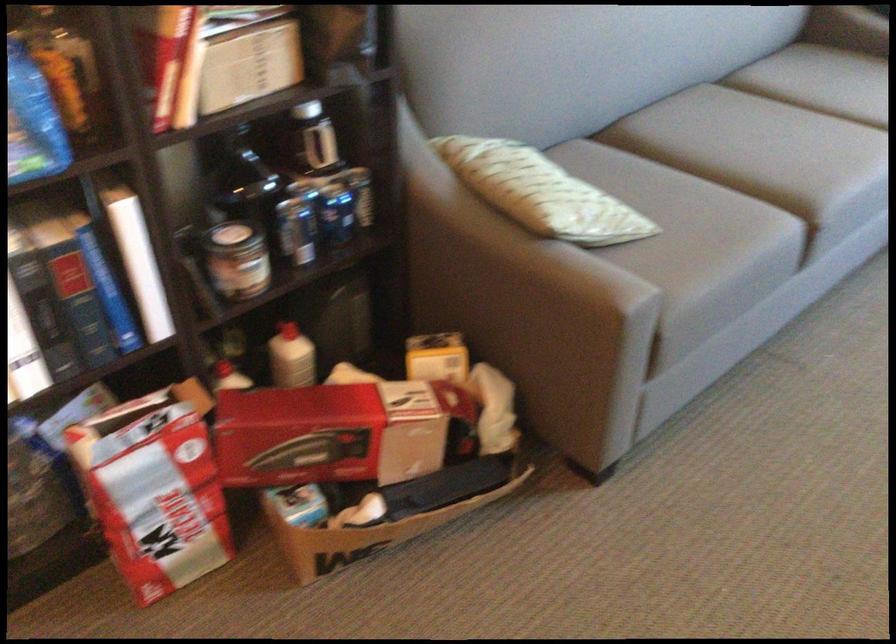
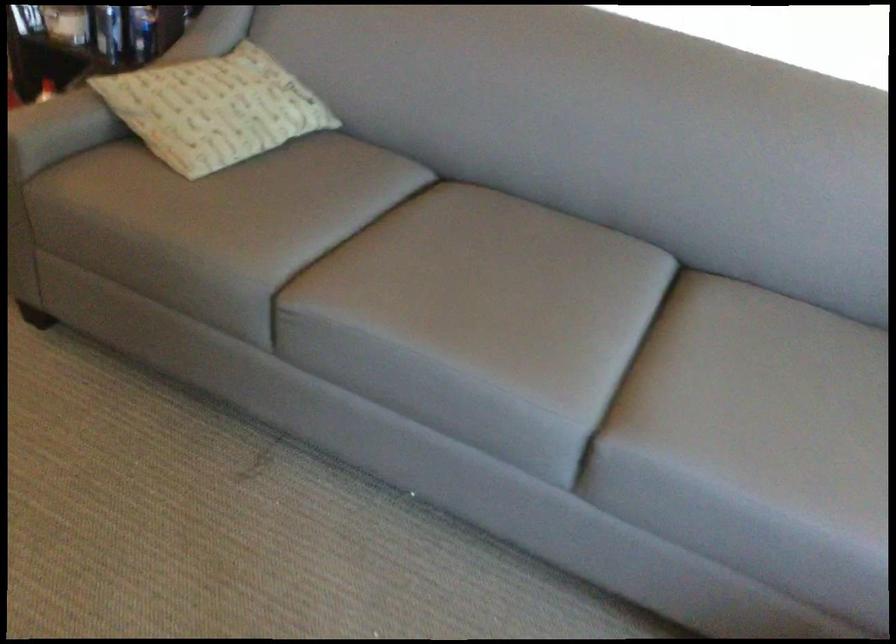
The point at (533,176) is marked in the first image. Where is the corresponding point in the second image?

(214, 93)